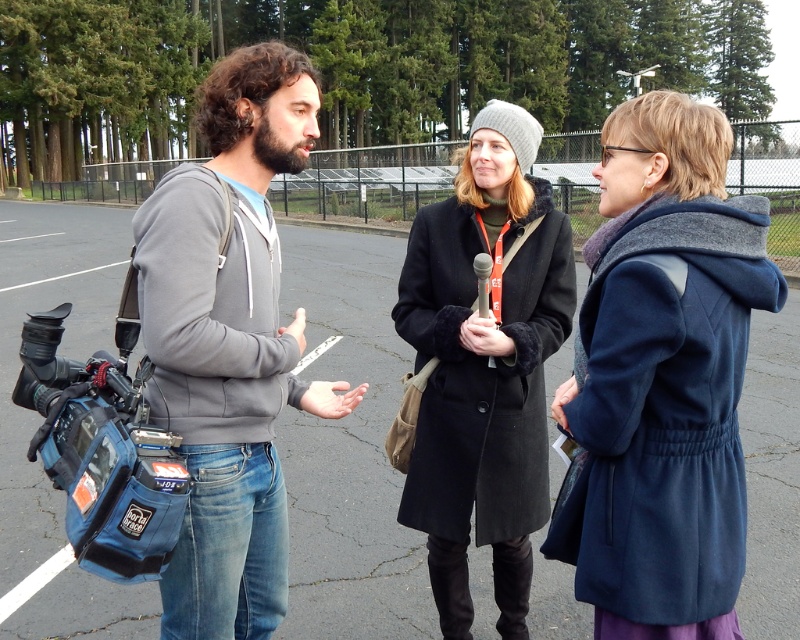
You are a photographer trying to capture a clear shot of the black wool coat at center. The blue fabric video camera at left is blocking your view. Can you move the camera to the side to get a better angle?

The black wool coat at center is taller than the blue fabric video camera at left, so moving the blue fabric video camera at left to the side might allow you to see over it, but the camera itself is smaller in height. However, since the coat is taller, you might still need to adjust your angle or position to fully capture it without obstruction.

In the scene shown: You are a fashion designer observing the two central figures in the scene. You need to determine which clothing item, the navy wool coat at center or the gray hoodie at center, would require a shorter sleeve length in its design. Based on the visual information provided, which one would that be?

The navy wool coat at center is shorter than the gray hoodie at center, so the navy wool coat at center would require a shorter sleeve length in its design.

You are standing at the point marked by the coordinates point (x=662, y=378). Looking around, you see the navy wool coat at center. Which direction should you walk to reach the camera mounted on the shoulder of the person on the left?

The camera mounted on the shoulder of the person on the left is to the left of the navy wool coat at center. So you should walk to the left.